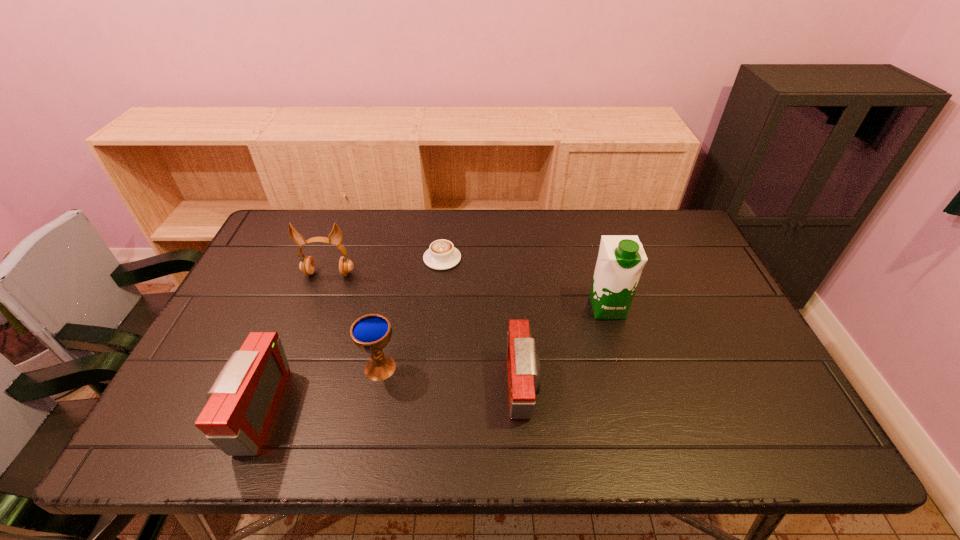
You are a GUI agent. You are given a task and a screenshot of the screen. Output one action in this format:
    pyautogui.click(x=<x>, y=<y>)
    Task: Click on the left camera
    
    Given the screenshot: What is the action you would take?
    pyautogui.click(x=242, y=402)

Image resolution: width=960 pixels, height=540 pixels. Identify the location of the fifth object from left to right. (523, 366).

Locate an element on the screen. This screenshot has height=540, width=960. the right camera is located at coordinates 523,366.

This screenshot has height=540, width=960. Find the location of `the shortest object`. the shortest object is located at coordinates (442, 255).

The image size is (960, 540). I want to click on the fourth object from left to right, so click(x=442, y=255).

Image resolution: width=960 pixels, height=540 pixels. In order to click on earphone in this screenshot , I will do `click(307, 265)`.

This screenshot has width=960, height=540. What are the coordinates of `chalice` in the screenshot? It's located at (370, 333).

You are a GUI agent. You are given a task and a screenshot of the screen. Output one action in this format:
    pyautogui.click(x=<x>, y=<y>)
    Task: Click on the rightmost object
    The height and width of the screenshot is (540, 960).
    Given the screenshot: What is the action you would take?
    (x=621, y=258)

At what (x,y) coordinates should I click in order to perform the action: click on soya milk. Please return your answer as a coordinate pair (x, y). The width and height of the screenshot is (960, 540). Looking at the image, I should click on (621, 258).

Locate an element on the screen. blank area located 0.060m on the front-facing side of the left camera is located at coordinates (211, 411).